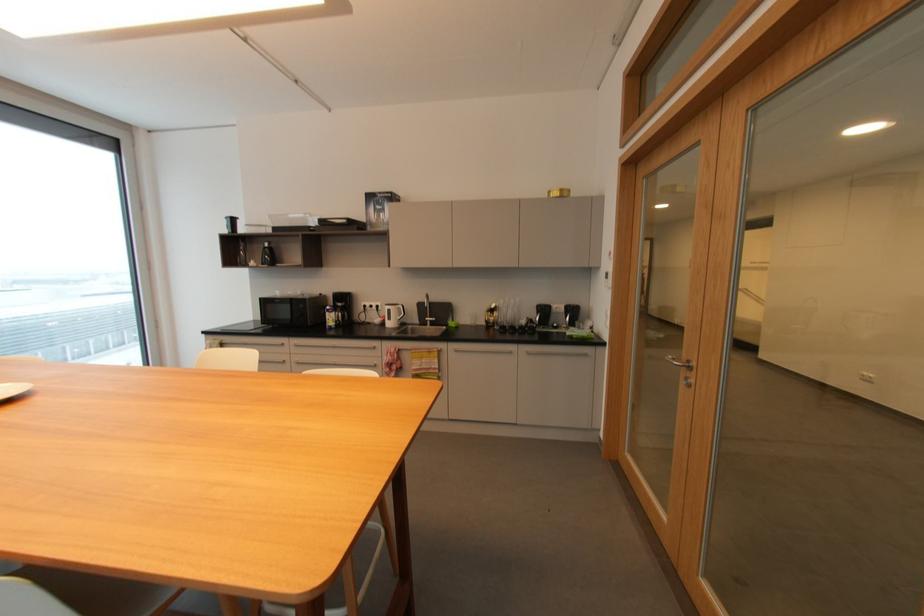
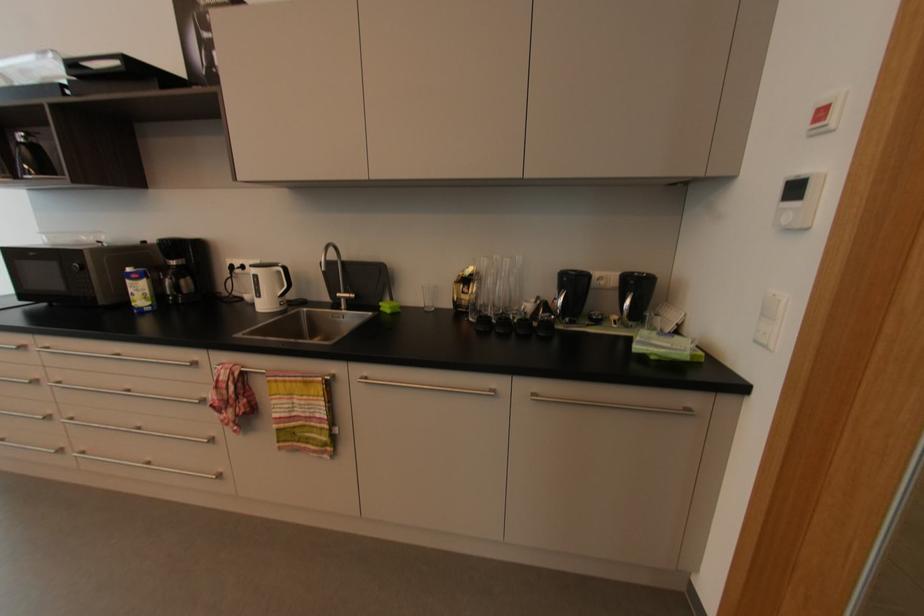
Question: The images are taken continuously from a first-person perspective. In which direction are you moving?

Choices:
 (A) Left
 (B) Right
 (C) Forward
 (D) Backward

Answer: (C)